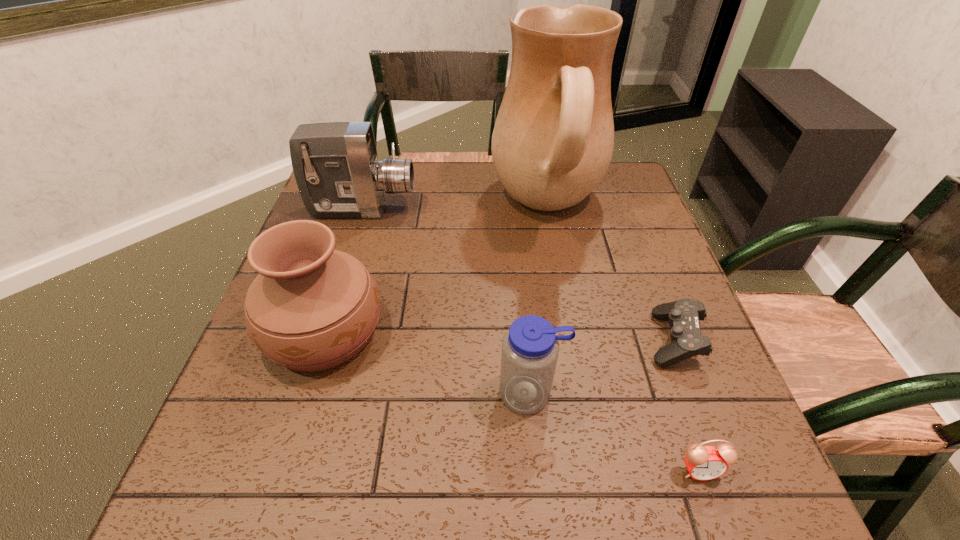
Where is `alarm clock located at the right edge`? This screenshot has height=540, width=960. alarm clock located at the right edge is located at coordinates (704, 463).

Find the location of a particular element. This screenshot has height=540, width=960. control at the right edge is located at coordinates (683, 315).

Where is `object that is at the far left corner`? The width and height of the screenshot is (960, 540). object that is at the far left corner is located at coordinates (335, 164).

Locate an element on the screen. object at the far right corner is located at coordinates (553, 140).

The height and width of the screenshot is (540, 960). Identify the location of object that is at the near right corner. (704, 463).

Where is `free space at the far edge of the desktop`? free space at the far edge of the desktop is located at coordinates (461, 167).

This screenshot has height=540, width=960. I want to click on free space at the near edge of the desktop, so click(x=545, y=494).

Where is `vacant position at the left edge of the desktop`? vacant position at the left edge of the desktop is located at coordinates (252, 414).

The width and height of the screenshot is (960, 540). In the image, there is a desktop. Find the location of `blank space at the right edge`. blank space at the right edge is located at coordinates (666, 373).

Identify the location of vacant space at the near left corner. (268, 496).